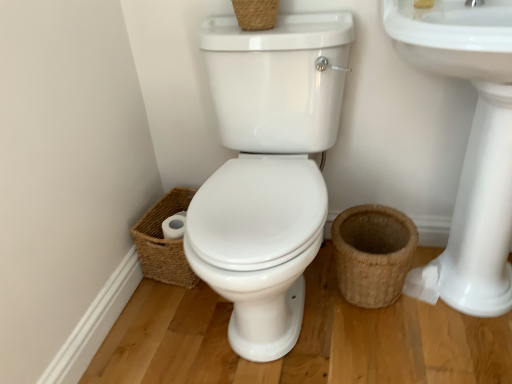
Question: Is woven brown basket at lower left, the 3th basket positioned from the right, at the left side of brown woven basket at lower right, placed as the 1th basket when sorted from bottom to top?

Choices:
 (A) yes
 (B) no

Answer: (A)

Question: From a real-world perspective, does woven brown basket at lower left, the 3th basket positioned from the right, stand above brown woven basket at lower right, placed as the 1th basket when sorted from bottom to top?

Choices:
 (A) yes
 (B) no

Answer: (B)

Question: From the image's perspective, would you say woven brown basket at lower left, the 3th basket positioned from the right, is positioned over brown woven basket at lower right, which ranks as the 3th basket in top-to-bottom order?

Choices:
 (A) yes
 (B) no

Answer: (A)

Question: Is brown woven basket at lower right, placed as the 1th basket when sorted from bottom to top, at the back of woven brown basket at lower left, acting as the first basket starting from the left?

Choices:
 (A) yes
 (B) no

Answer: (B)

Question: Is woven brown basket at lower left, the 3th basket positioned from the right, bigger than brown woven basket at lower right, placed as the 1th basket when sorted from bottom to top?

Choices:
 (A) yes
 (B) no

Answer: (B)

Question: Does woven brown basket at lower left, acting as the first basket starting from the left, appear on the right side of brown woven basket at lower right, which appears as the 3th basket when viewed from the left?

Choices:
 (A) yes
 (B) no

Answer: (B)

Question: Are woven brown basket at upper center, which is the 2th basket in right-to-left order, and brown woven basket at lower right, which appears as the 3th basket when viewed from the left, beside each other?

Choices:
 (A) yes
 (B) no

Answer: (B)

Question: Is the depth of woven brown basket at upper center, arranged as the 2th basket when viewed from the left, less than that of brown woven basket at lower right, the first basket from the right?

Choices:
 (A) yes
 (B) no

Answer: (A)

Question: Can you confirm if woven brown basket at upper center, which is the 2th basket in right-to-left order, is positioned to the left of brown woven basket at lower right, the first basket from the right?

Choices:
 (A) yes
 (B) no

Answer: (A)

Question: Is woven brown basket at upper center, acting as the third basket starting from the bottom, looking in the opposite direction of brown woven basket at lower right, the first basket from the right?

Choices:
 (A) no
 (B) yes

Answer: (A)

Question: Considering the relative sizes of woven brown basket at upper center, the 1th basket in the top-to-bottom sequence, and brown woven basket at lower right, which ranks as the 3th basket in top-to-bottom order, in the image provided, is woven brown basket at upper center, the 1th basket in the top-to-bottom sequence, shorter than brown woven basket at lower right, which ranks as the 3th basket in top-to-bottom order,?

Choices:
 (A) no
 (B) yes

Answer: (B)

Question: Can you confirm if woven brown basket at upper center, which is the 2th basket in right-to-left order, is thinner than brown woven basket at lower right, which ranks as the 3th basket in top-to-bottom order?

Choices:
 (A) yes
 (B) no

Answer: (A)

Question: From the image's perspective, does woven brown basket at upper center, the 1th basket in the top-to-bottom sequence, appear higher than woven brown basket at lower left, acting as the first basket starting from the left?

Choices:
 (A) no
 (B) yes

Answer: (B)